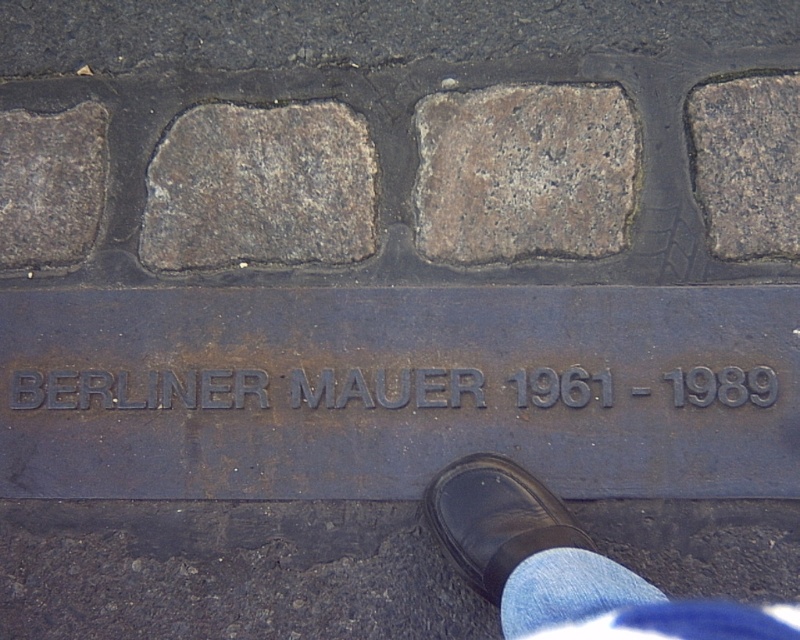
Question: Which object appears farthest from the camera in this image?

Choices:
 (A) gray stone brick at center
 (B) gray stone brick at upper right
 (C) black embossed text at center

Answer: (A)

Question: Does dark gray stone at left have a greater width compared to black leather shoe at lower center?

Choices:
 (A) yes
 (B) no

Answer: (B)

Question: Which point is farther to the camera?

Choices:
 (A) black leather shoe at lower center
 (B) black embossed text at center
 (C) dark gray stone at left

Answer: (C)

Question: Does gray stone brick at center have a smaller size compared to dark gray stone at left?

Choices:
 (A) yes
 (B) no

Answer: (B)

Question: Does black leather shoe at lower right have a lesser width compared to gray stone brick at upper right?

Choices:
 (A) yes
 (B) no

Answer: (B)

Question: Among these points, which one is farthest from the camera?

Choices:
 (A) (582, 563)
 (B) (214, 188)
 (C) (752, 237)

Answer: (B)